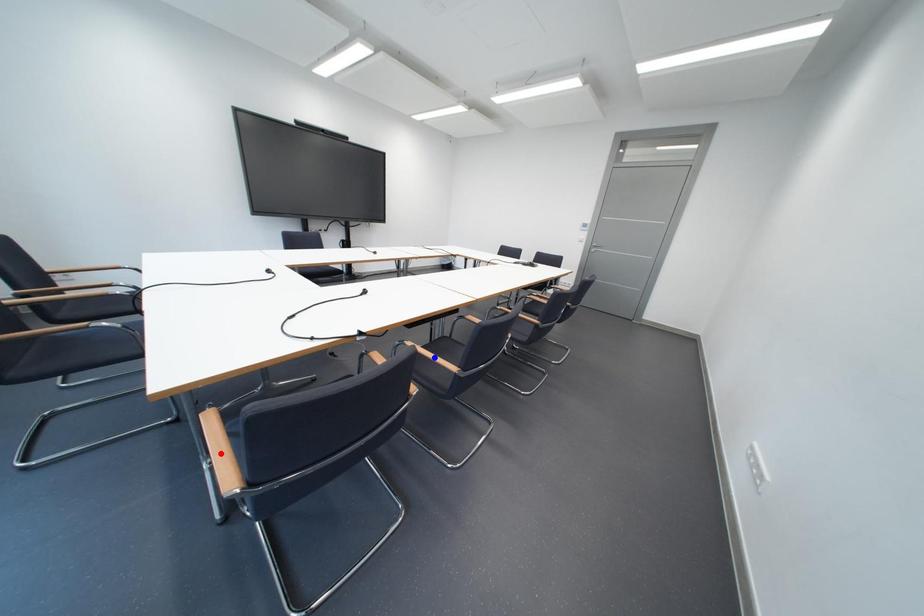
Question: Two points are marked on the image. Which point is closer to the camera?

Choices:
 (A) Blue point is closer.
 (B) Red point is closer.

Answer: (B)